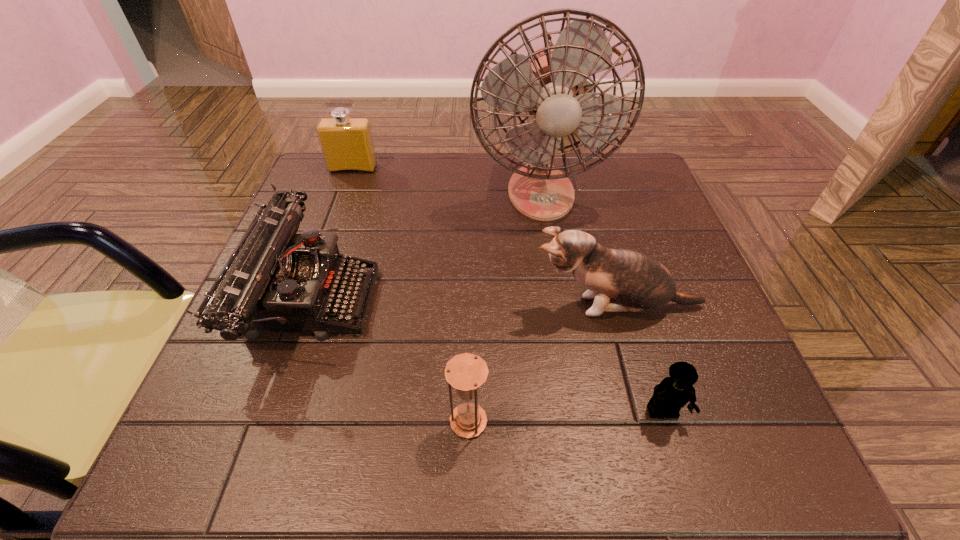
Locate an element on the screen. Image resolution: width=960 pixels, height=540 pixels. free spot that satisfies the following two spatial constraints: 1. on the front-facing side of the hourglass; 2. on the left side of the perfume is located at coordinates (261, 421).

Locate an element on the screen. This screenshot has width=960, height=540. free space that satisfies the following two spatial constraints: 1. on the front-facing side of the hourglass; 2. on the left side of the perfume is located at coordinates (261, 421).